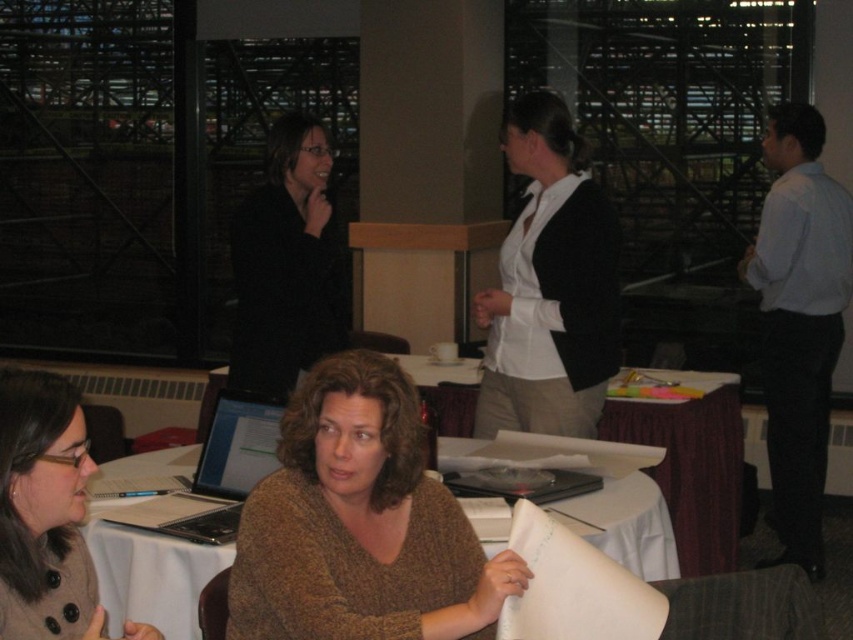
You are an assistant in the conference room. You need to hand a document to the person wearing the brown soft sweater at center without disturbing the one in the white matte shirt at center. How should you approach the table?

The brown soft sweater at center is positioned under the white matte shirt at center, so you should approach from the side opposite to the white matte shirt at center to avoid disturbing them.

You are a photographer in the room and want to take a photo of both the brown soft sweater at center and the white matte shirt at center. To ensure both are clearly visible in the photo, which one should you focus on first?

You should focus on the brown soft sweater at center first because it is in front of the white matte shirt at center, so focusing on the front object ensures both will be in focus.